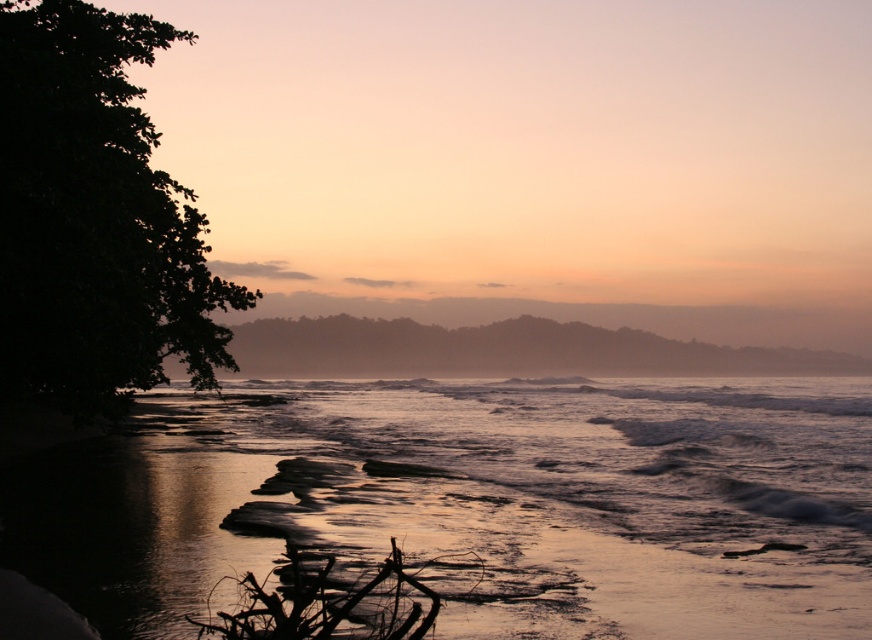
You are standing on the beach and want to take a photo of the dark green leafy tree at left without the shiny wet sand at lower center in the foreground. Is this possible?

The shiny wet sand at lower center is larger in size than the dark green leafy tree at left, so it might block the view of the tree. To avoid the sand in the foreground, you might need to move closer to the tree or adjust your angle to frame the tree without the sand obstructing it.

You are standing on the beach and see the shiny wet sand at lower center and the dark green leafy tree at left. Which object is closer to the water?

The shiny wet sand at lower center is positioned under the dark green leafy tree at left, meaning it is closer to the water than the tree.

You are standing at the shoreline and want to walk towards the dark green leafy tree at left. Given that the shiny wet sand at lower center is wider than the tree, will you have to walk across the sand before reaching the tree?

Yes, since the shiny wet sand at lower center is wider than the dark green leafy tree at left, you will need to traverse the sand before reaching the tree.